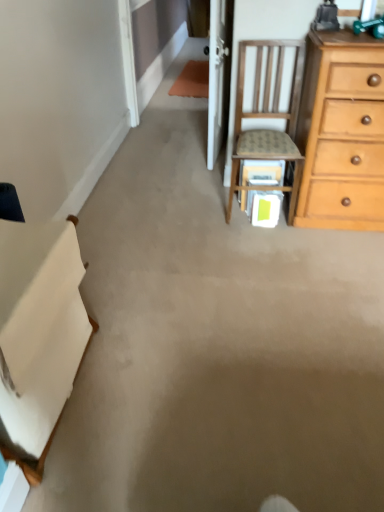
Question: Is white fabric at left bigger than wooden chair at upper right?

Choices:
 (A) no
 (B) yes

Answer: (B)

Question: Is the depth of white fabric at left greater than that of wooden chair at upper right?

Choices:
 (A) no
 (B) yes

Answer: (A)

Question: Considering the relative positions of white fabric at left and wooden chair at upper right in the image provided, is white fabric at left to the right of wooden chair at upper right from the viewer's perspective?

Choices:
 (A) yes
 (B) no

Answer: (B)

Question: Is there a large distance between white fabric at left and wooden chair at upper right?

Choices:
 (A) yes
 (B) no

Answer: (A)

Question: Is white fabric at left looking in the opposite direction of wooden chair at upper right?

Choices:
 (A) yes
 (B) no

Answer: (B)

Question: Are white fabric at left and wooden chair at upper right making contact?

Choices:
 (A) no
 (B) yes

Answer: (A)

Question: Is wooden chair at upper right shorter than white fabric at left?

Choices:
 (A) no
 (B) yes

Answer: (A)

Question: Does wooden chair at upper right have a greater width compared to white fabric at left?

Choices:
 (A) yes
 (B) no

Answer: (A)

Question: From the image's perspective, would you say wooden chair at upper right is shown under white fabric at left?

Choices:
 (A) yes
 (B) no

Answer: (B)

Question: From a real-world perspective, does wooden chair at upper right sit lower than white fabric at left?

Choices:
 (A) yes
 (B) no

Answer: (B)

Question: From a real-world perspective, is wooden chair at upper right physically above white fabric at left?

Choices:
 (A) no
 (B) yes

Answer: (B)

Question: Is wooden chair at upper right to the right of white fabric at left from the viewer's perspective?

Choices:
 (A) yes
 (B) no

Answer: (A)

Question: Which is correct: white fabric at left is inside wooden chair at upper right, or outside of it?

Choices:
 (A) outside
 (B) inside

Answer: (A)